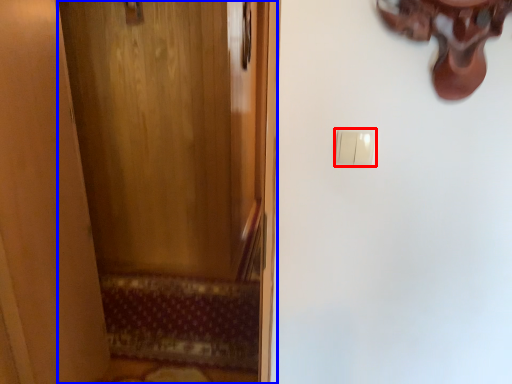
Question: Among these objects, which one is nearest to the camera, light switch (highlighted by a red box) or door (highlighted by a blue box)?

Choices:
 (A) light switch
 (B) door

Answer: (B)